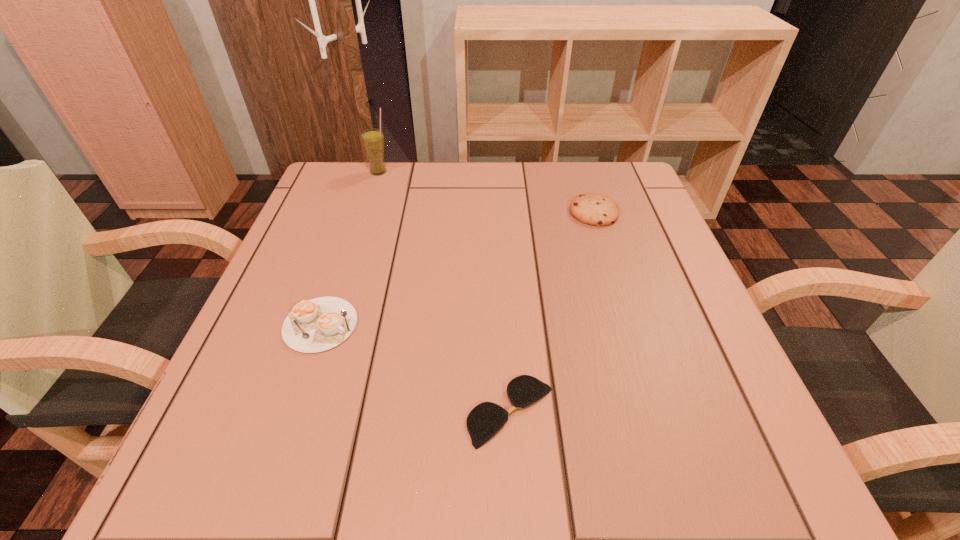
Find the location of a particular element. This screenshot has height=540, width=960. vacant space located 0.120m on the back of the cappuccino is located at coordinates (344, 255).

This screenshot has height=540, width=960. Find the location of `vacant space situated on the back of the spectacles`. vacant space situated on the back of the spectacles is located at coordinates (502, 261).

Where is `straw for drinking located at the far edge`? The width and height of the screenshot is (960, 540). straw for drinking located at the far edge is located at coordinates (372, 139).

You are a GUI agent. You are given a task and a screenshot of the screen. Output one action in this format:
    pyautogui.click(x=<x>, y=<y>)
    Task: Click on the cookie that is at the far edge
    
    Given the screenshot: What is the action you would take?
    pyautogui.click(x=593, y=209)

Identify the location of object that is at the near edge. The image size is (960, 540). (486, 419).

This screenshot has height=540, width=960. What are the coordinates of `straw for drinking that is at the left edge` in the screenshot? It's located at (372, 139).

Identify the location of cappuccino located at the left edge. (316, 325).

Image resolution: width=960 pixels, height=540 pixels. Find the location of `object at the right edge`. object at the right edge is located at coordinates (593, 209).

Where is `object present at the far left corner`? This screenshot has width=960, height=540. object present at the far left corner is located at coordinates (372, 139).

This screenshot has width=960, height=540. I want to click on object located in the far right corner section of the desktop, so click(593, 209).